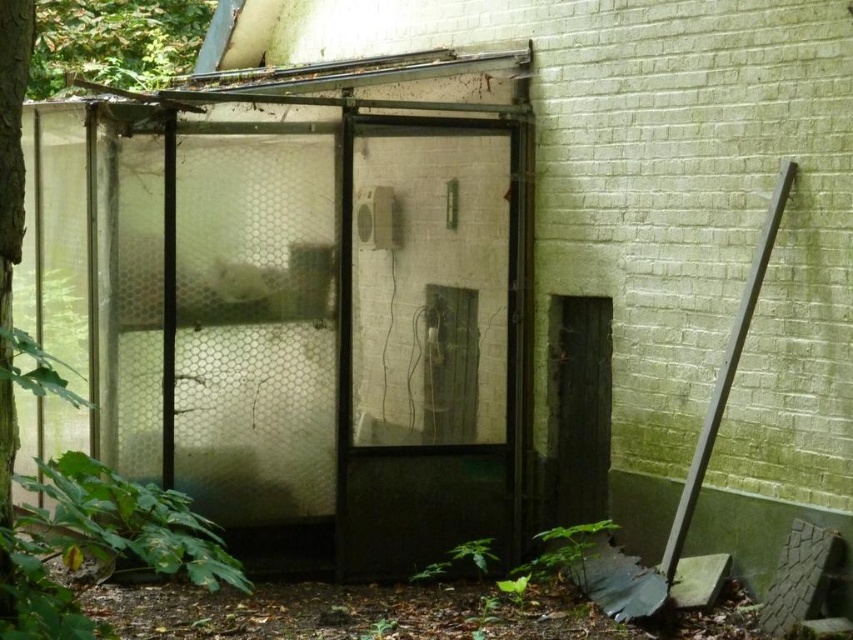
You are standing at point (x=426, y=236) and want to walk towards the greenhouse structure. Is the distance between your current position and the greenhouse structure sufficient for you to walk comfortably? Please consider that an average person requires at least 15 feet of space to move freely.

The distance between point (x=426, y=236) and the greenhouse structure is 21.10 feet, which is more than the required 15 feet. Therefore, there is enough space for you to walk comfortably towards the greenhouse structure.

From the picture: You are a maintenance worker assigned to inspect the transparent plastic cage at center. According to the coordinates provided, where exactly should you look to find it?

The transparent plastic cage at center is located at point coordinates of (318, 324).

You are a gardener who needs to access the dark gray metal shovel at right. However, you notice the transparent plastic screen door at center is blocking your path. Can you move the shovel without opening the door?

The transparent plastic screen door at center is positioned over the dark gray metal shovel at right, meaning the door is above the shovel. Since the door is above it, you can reach and move the shovel without needing to open the door.